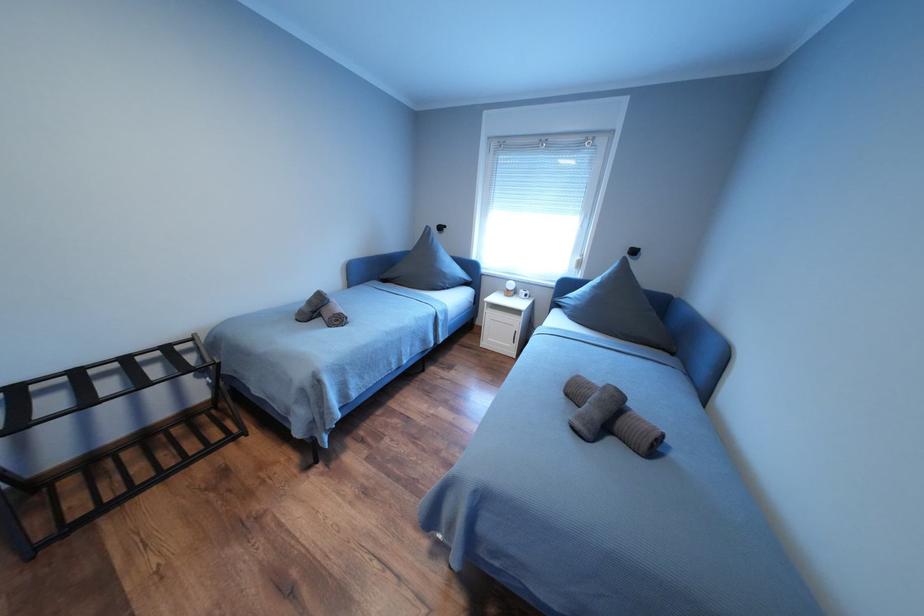
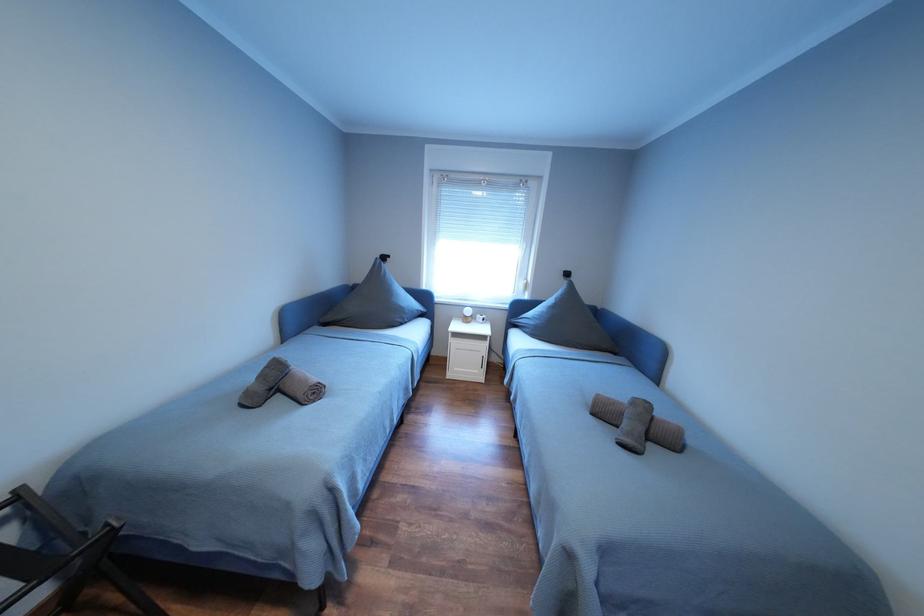
Question: In a continuous first-person perspective shot, in which direction is the camera moving?

Choices:
 (A) Left
 (B) Right
 (C) Forward
 (D) Backward

Answer: (A)